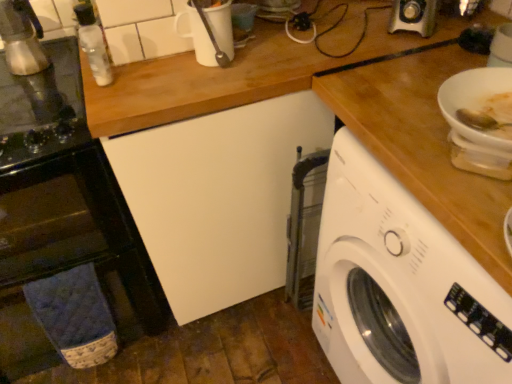
Question: Should I look upward or downward to see metallic silver coffee maker at left, which is the 1th appliance from bottom to top?

Choices:
 (A) up
 (B) down

Answer: (A)

Question: Is the surface of metallic silver espresso maker at left, the first appliance in the top-to-bottom sequence, in direct contact with metallic silver coffee maker at left, which is the 1th appliance from bottom to top?

Choices:
 (A) yes
 (B) no

Answer: (B)

Question: Could you tell me if metallic silver espresso maker at left, arranged as the 2th appliance when ordered from the bottom, is facing metallic silver coffee maker at left, placed as the second appliance when sorted from top to bottom?

Choices:
 (A) no
 (B) yes

Answer: (B)

Question: Can you confirm if metallic silver espresso maker at left, arranged as the 2th appliance when ordered from the bottom, is thinner than metallic silver coffee maker at left, which is the 1th appliance from bottom to top?

Choices:
 (A) yes
 (B) no

Answer: (A)

Question: From the image's perspective, is metallic silver espresso maker at left, the first appliance in the top-to-bottom sequence, on top of metallic silver coffee maker at left, which is the 1th appliance from bottom to top?

Choices:
 (A) no
 (B) yes

Answer: (B)

Question: Does metallic silver espresso maker at left, arranged as the 2th appliance when ordered from the bottom, have a lesser height compared to metallic silver coffee maker at left, which is the 1th appliance from bottom to top?

Choices:
 (A) no
 (B) yes

Answer: (A)

Question: Considering the relative sizes of metallic silver espresso maker at left, arranged as the 2th appliance when ordered from the bottom, and metallic silver coffee maker at left, which is the 1th appliance from bottom to top, in the image provided, is metallic silver espresso maker at left, arranged as the 2th appliance when ordered from the bottom, smaller than metallic silver coffee maker at left, which is the 1th appliance from bottom to top,?

Choices:
 (A) no
 (B) yes

Answer: (B)

Question: From a real-world perspective, is white plastic washing machine at right positioned under metallic silver espresso maker at left, the first appliance in the top-to-bottom sequence, based on gravity?

Choices:
 (A) yes
 (B) no

Answer: (A)

Question: Would you say white plastic washing machine at right contains metallic silver espresso maker at left, arranged as the 2th appliance when ordered from the bottom?

Choices:
 (A) no
 (B) yes

Answer: (A)

Question: Is white plastic washing machine at right positioned behind metallic silver espresso maker at left, the first appliance in the top-to-bottom sequence?

Choices:
 (A) no
 (B) yes

Answer: (A)

Question: Considering the relative sizes of white plastic washing machine at right and metallic silver espresso maker at left, arranged as the 2th appliance when ordered from the bottom, in the image provided, is white plastic washing machine at right smaller than metallic silver espresso maker at left, arranged as the 2th appliance when ordered from the bottom,?

Choices:
 (A) yes
 (B) no

Answer: (B)

Question: Does white plastic washing machine at right have a lesser width compared to metallic silver espresso maker at left, the first appliance in the top-to-bottom sequence?

Choices:
 (A) no
 (B) yes

Answer: (A)

Question: Does white plastic washing machine at right lie in front of metallic silver espresso maker at left, the first appliance in the top-to-bottom sequence?

Choices:
 (A) no
 (B) yes

Answer: (B)

Question: Is white plastic washing machine at right at the right side of metallic silver coffee maker at left, placed as the second appliance when sorted from top to bottom?

Choices:
 (A) yes
 (B) no

Answer: (A)